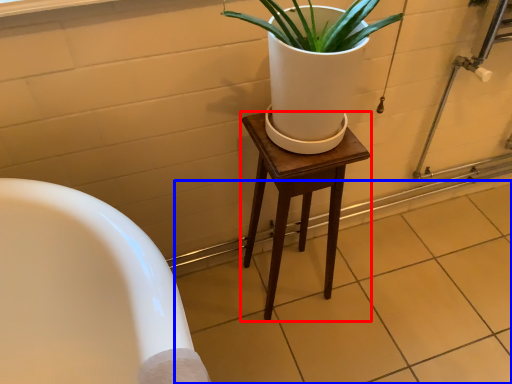
Question: Which point is further to the camera, stool (highlighted by a red box) or tile (highlighted by a blue box)?

Choices:
 (A) stool
 (B) tile

Answer: (B)